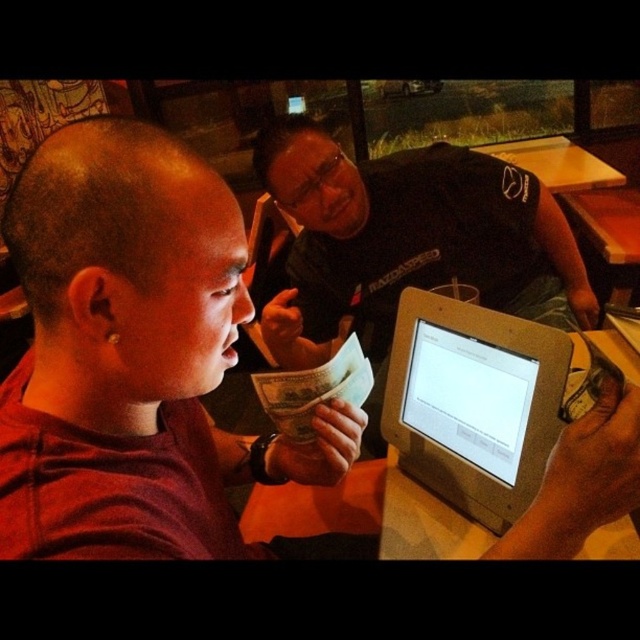
Is silver metallic monitor at center positioned behind wooden table at upper center?

That is False.

Is silver metallic monitor at center taller than wooden table at upper center?

Incorrect, silver metallic monitor at center's height is not larger of wooden table at upper center's.

Identify the location of silver metallic monitor at center. This screenshot has height=640, width=640. click(468, 397).

Between silver metallic tablet at center and wooden table at upper center, which one has more height?

wooden table at upper center is taller.

At what (x,y) coordinates should I click in order to perform the action: click on silver metallic tablet at center. Please return your answer as a coordinate pair (x, y). The height and width of the screenshot is (640, 640). Looking at the image, I should click on (474, 403).

This screenshot has width=640, height=640. What are the coordinates of `silver metallic tablet at center` in the screenshot? It's located at (474, 403).

Which is in front, point (428, 147) or point (465, 307)?

Positioned in front is point (465, 307).

Is point (275, 333) more distant than point (518, 358)?

Yes, it is.

The width and height of the screenshot is (640, 640). I want to click on black matte shirt at center, so click(406, 237).